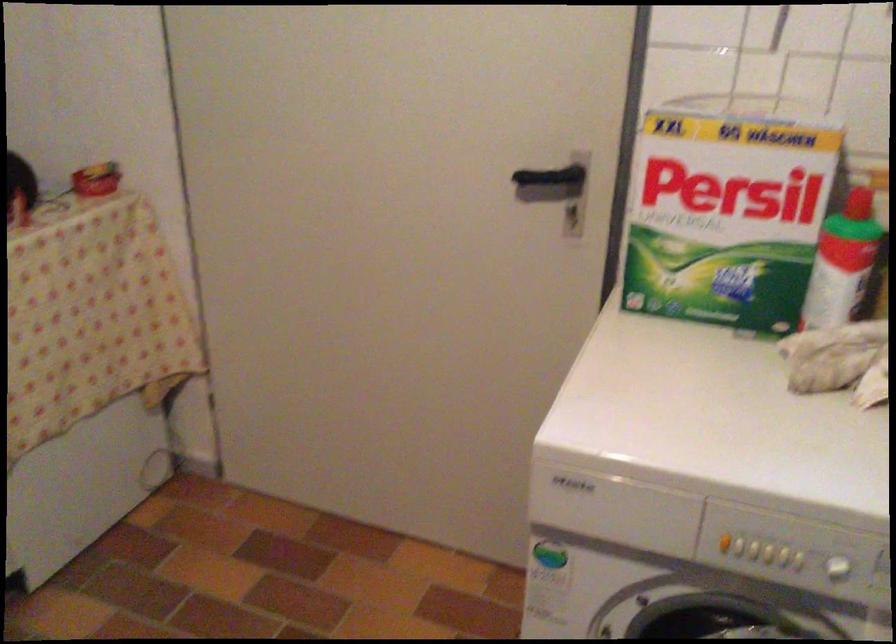
Describe the element at coordinates (843, 574) in the screenshot. The width and height of the screenshot is (896, 644). I see `a washing machine dial` at that location.